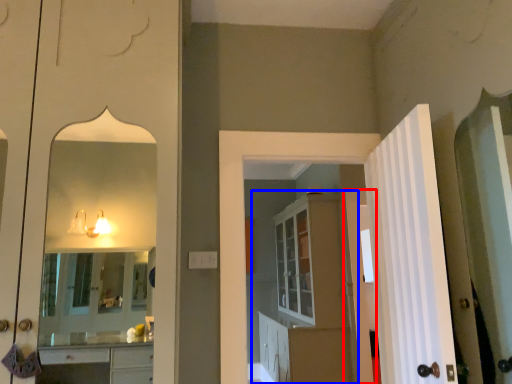
Question: Which object is further to the camera taking this photo, door (highlighted by a red box) or dresser (highlighted by a blue box)?

Choices:
 (A) door
 (B) dresser

Answer: (A)